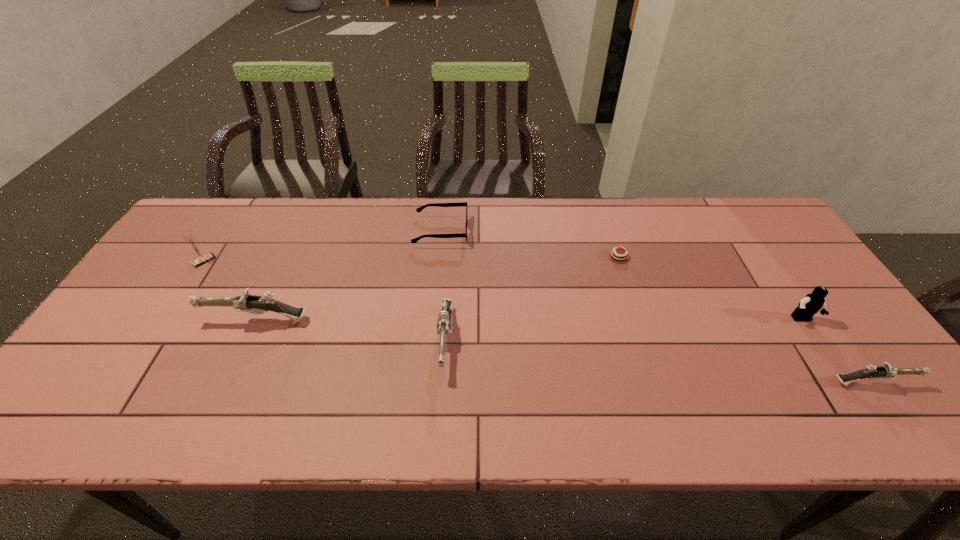
Find the location of a particular element. spot to insert another gun for uniform distribution is located at coordinates (650, 361).